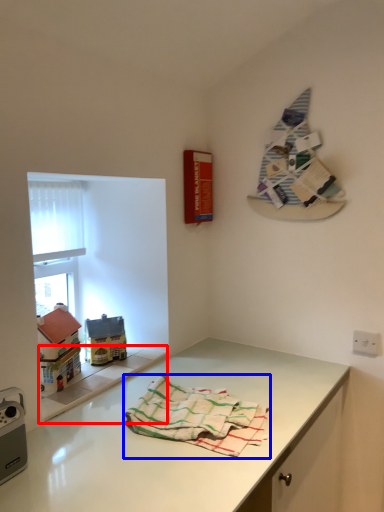
Question: Which point is closer to the camera, window sill (highlighted by a red box) or towel (highlighted by a blue box)?

Choices:
 (A) window sill
 (B) towel

Answer: (B)